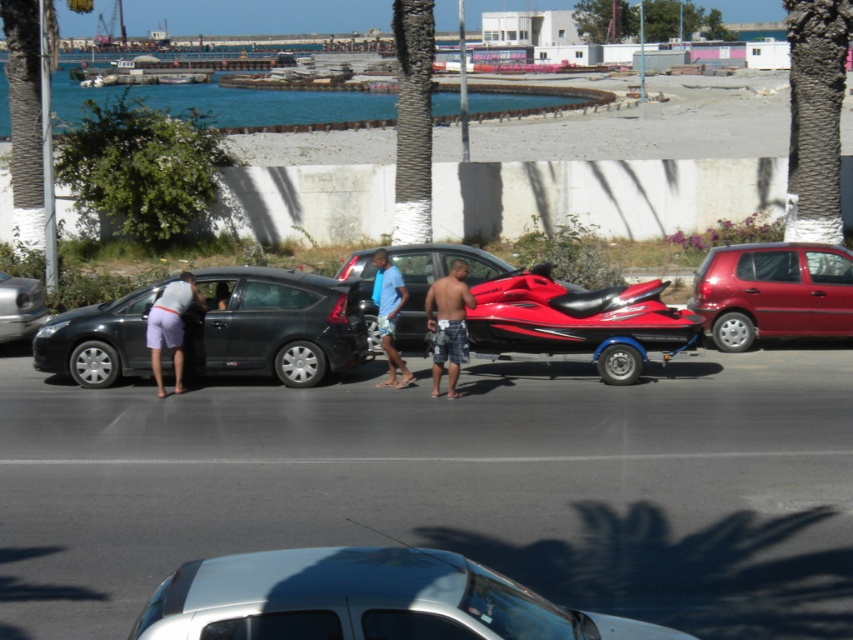
Question: Does plaid shorts at center appear on the right side of light purple shorts at left?

Choices:
 (A) yes
 (B) no

Answer: (A)

Question: Which point is closer to the camera?

Choices:
 (A) metallic red car at right
 (B) metallic silver car at left
 (C) shiny red jet ski at center
 (D) blue denim shorts at center

Answer: (C)

Question: Can you confirm if matte black car at left is positioned to the left of light purple shorts at left?

Choices:
 (A) yes
 (B) no

Answer: (B)

Question: Which object is closer to the camera taking this photo?

Choices:
 (A) plaid shorts at center
 (B) white glossy car at center
 (C) metallic red car at right

Answer: (B)

Question: Which point is closer to the camera?

Choices:
 (A) light purple shorts at left
 (B) metallic silver car at left
 (C) metallic red car at right

Answer: (A)

Question: Is shiny red jet ski at center smaller than plaid shorts at center?

Choices:
 (A) yes
 (B) no

Answer: (B)